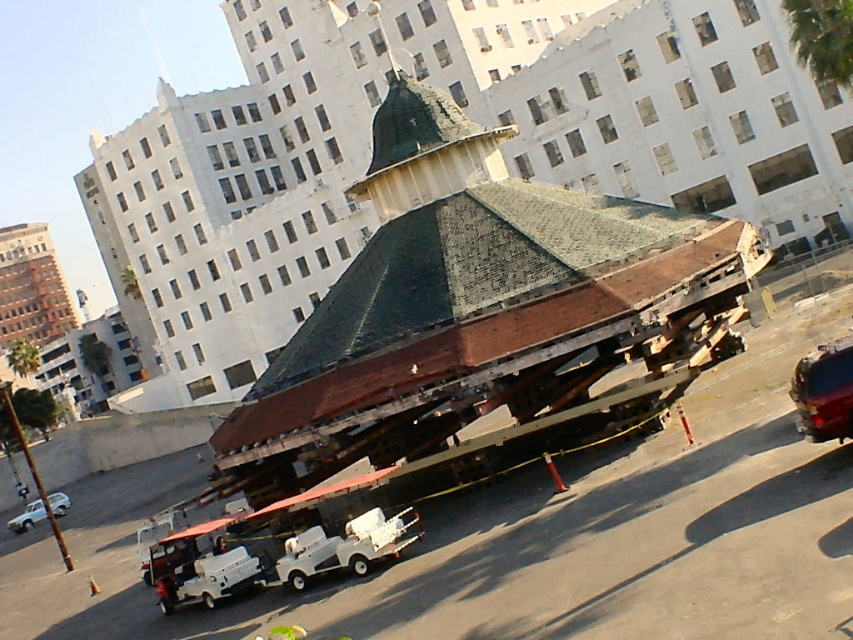
You are standing at the point closest to the large multi story building with white facade. You want to move towards the partially dismantled structure. Which point should you head towards, point (233, 448) or point (189, 560)?

Point (233, 448) is behind point (189, 560). Since you are moving towards the partially dismantled structure, you should head towards point (189, 560) as it is closer to your current position near the large multi story building.

You are a delivery person who needs to park your white matte golf cart at lower left near the rusty metal gazebo at center. Given that the golf cart is 1.5 meters wide, will there be enough space between the gazebo and the nearby wall to park comfortably?

The rusty metal gazebo at center is larger than the white matte golf cart at lower left, but the description does not provide specific measurements of the space between the gazebo and the wall. Therefore, it is uncertain if there is enough space to park comfortably.